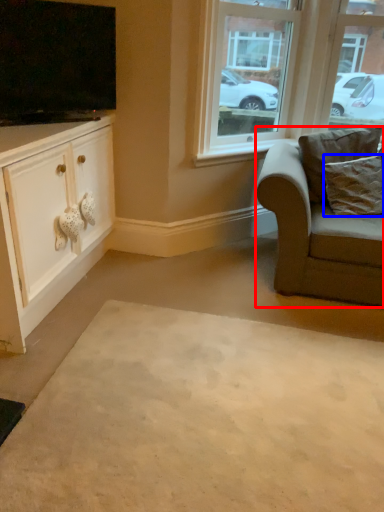
Question: Which object appears farthest to the camera in this image, chair (highlighted by a red box) or pillow (highlighted by a blue box)?

Choices:
 (A) chair
 (B) pillow

Answer: (B)